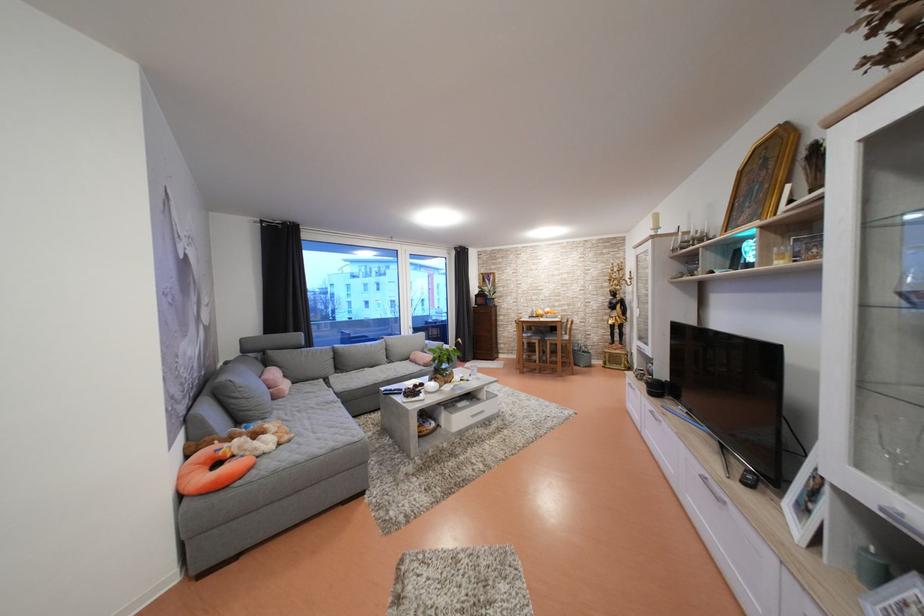
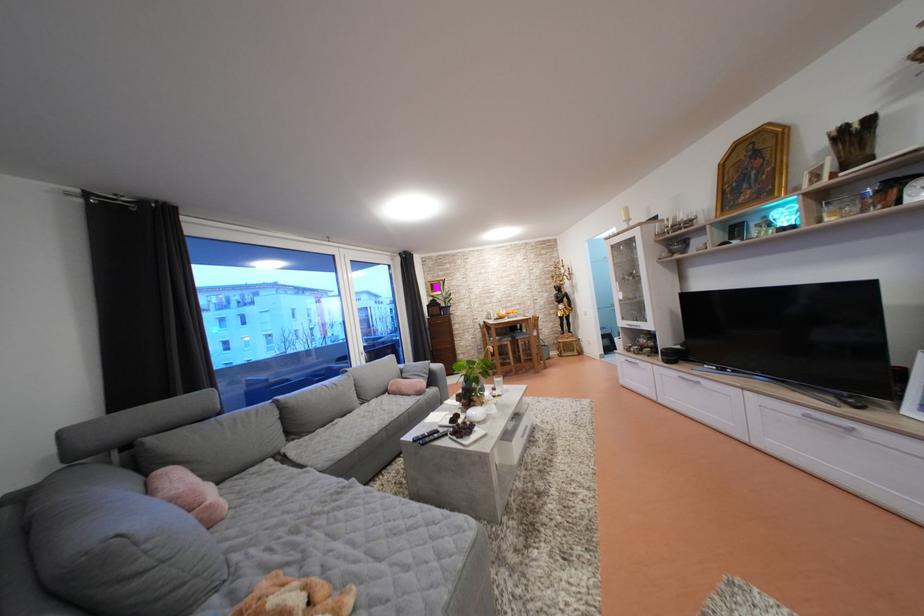
In the second image, find the point that corresponds to point 300,387 in the first image.

(225, 488)